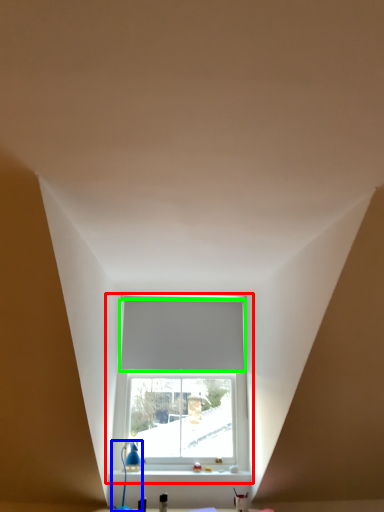
Question: Considering the real-world distances, which object is closest to window (highlighted by a red box)? table lamp (highlighted by a blue box) or blind (highlighted by a green box).

Choices:
 (A) table lamp
 (B) blind

Answer: (B)